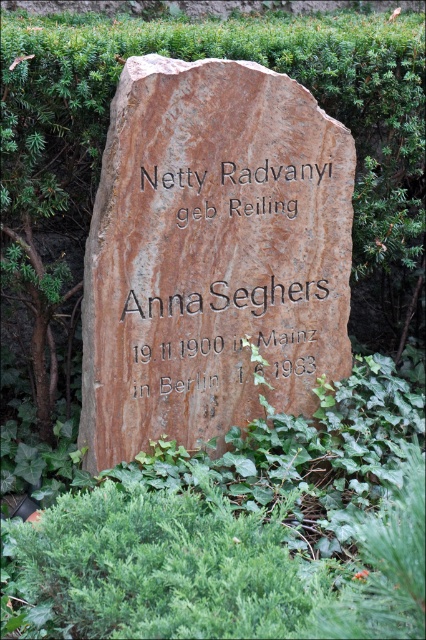
Question: Does brown stone boulder at center have a lesser width compared to matte stone inscription at center?

Choices:
 (A) yes
 (B) no

Answer: (B)

Question: Which object appears closest to the camera in this image?

Choices:
 (A) matte stone inscription at center
 (B) brown stone boulder at center

Answer: (B)

Question: Does brown stone boulder at center have a greater width compared to matte stone inscription at center?

Choices:
 (A) yes
 (B) no

Answer: (A)

Question: Is brown stone boulder at center further to camera compared to matte stone inscription at center?

Choices:
 (A) no
 (B) yes

Answer: (A)

Question: Which object is farther from the camera taking this photo?

Choices:
 (A) brown stone boulder at center
 (B) matte stone inscription at center

Answer: (B)